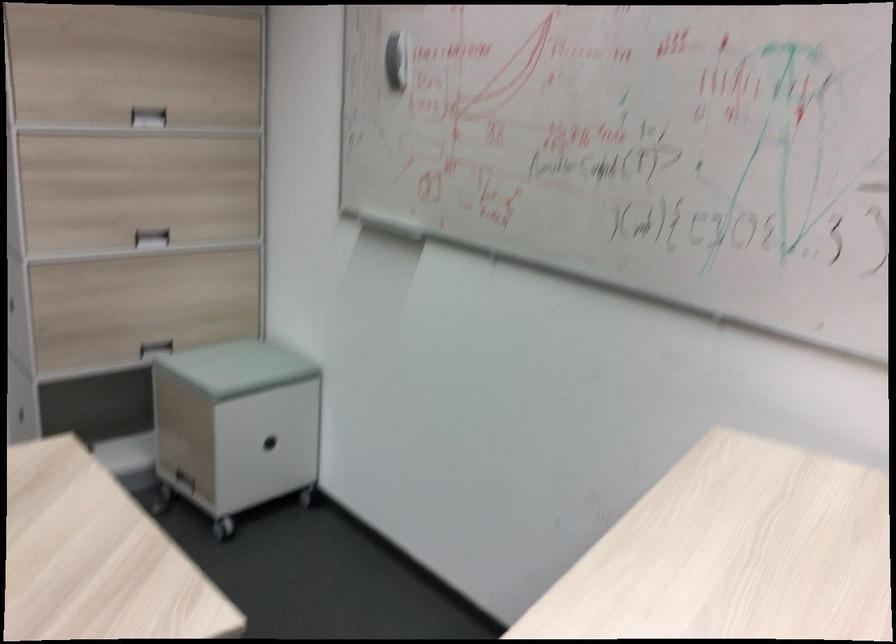
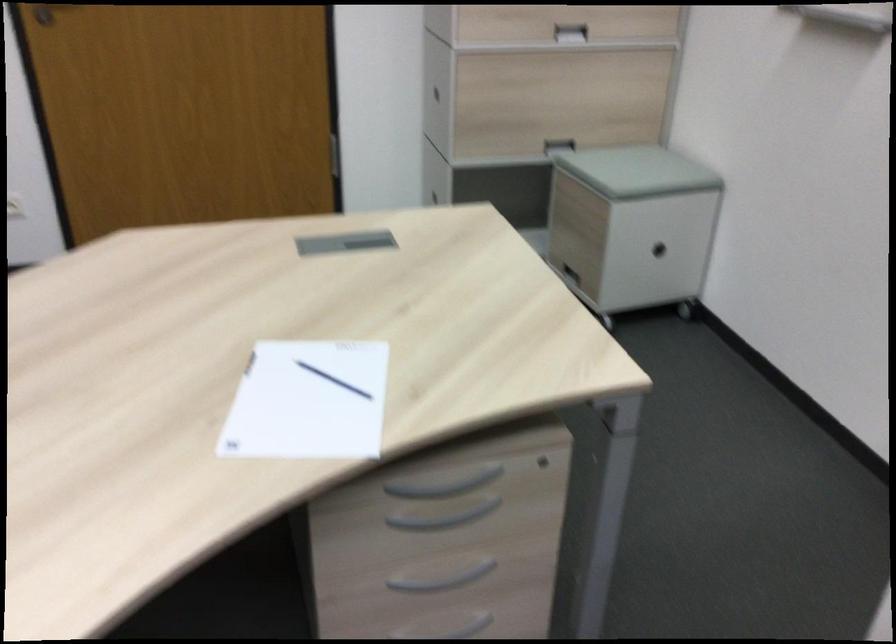
In the second image, find the point that corresponds to (238,368) in the first image.

(638, 171)